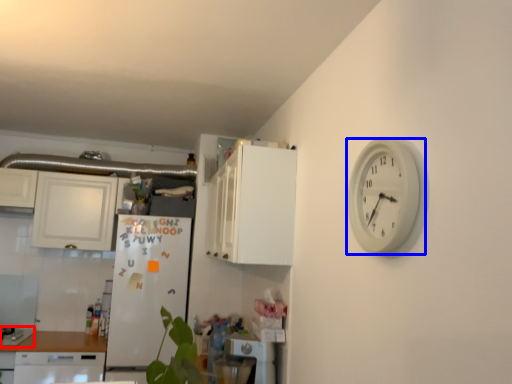
Question: Among these objects, which one is nearest to the camera, gas stove (highlighted by a red box) or wall clock (highlighted by a blue box)?

Choices:
 (A) gas stove
 (B) wall clock

Answer: (B)